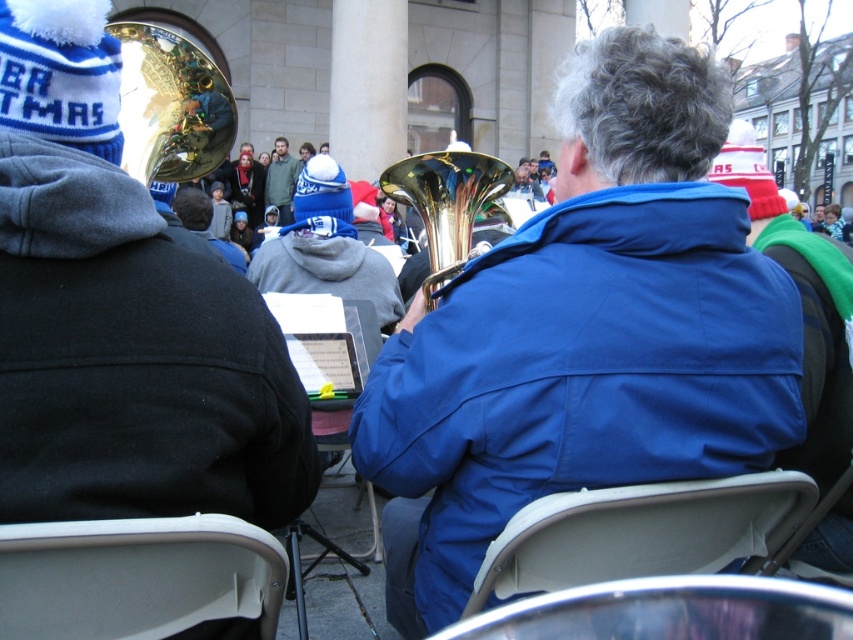
Question: Estimate the real-world distances between objects in this image. Which object is closer to the gold shiny trumpet at center?

Choices:
 (A) metallic silver chair at lower center
 (B) blue fabric jacket at center

Answer: (B)

Question: Does blue fabric jacket at center have a smaller size compared to gold shiny trumpet at center?

Choices:
 (A) yes
 (B) no

Answer: (A)

Question: Does white plastic chair at lower left have a smaller size compared to gray hoodie at center?

Choices:
 (A) yes
 (B) no

Answer: (A)

Question: Is white plastic chair at lower left positioned at the back of white plastic chair at center?

Choices:
 (A) yes
 (B) no

Answer: (B)

Question: Based on their relative distances, which object is farther from the gold reflective trumpet at upper left?

Choices:
 (A) gray hoodie at center
 (B) metallic silver chair at lower center
 (C) white plastic chair at lower left
 (D) blue fabric jacket at center

Answer: (A)

Question: Among these objects, which one is nearest to the camera?

Choices:
 (A) white plastic chair at lower left
 (B) shiny gold tuba at center
 (C) gold shiny trumpet at center
 (D) blue fabric jacket at center

Answer: (A)